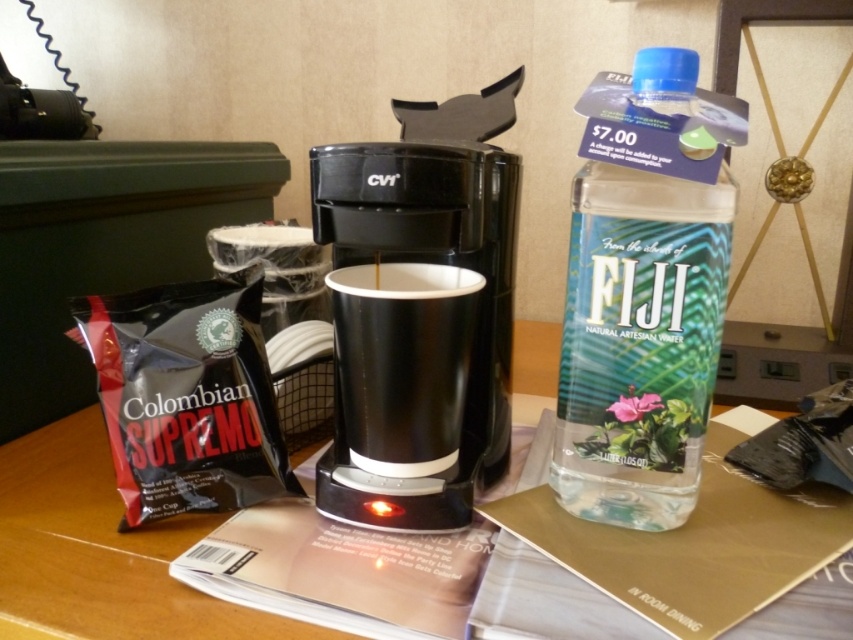
What object is located at the coordinates point (421, 310)?

The point (421, 310) indicates the black plastic coffee maker at center.

You are a hotel guest who wants to grab both items located at point coordinates point (x=476, y=227) and point (x=421, y=336). Since you can only reach one at a time, which item should you reach for first to ensure you can grab both without moving your hand?

You should reach for point (x=421, y=336) first because point (x=476, y=227) is behind it. By grabbing the closer item first, you can then move to the one behind without obstruction.

Based on the photo, you are a hotel guest who wants to place a small note on the table near the coffee maker. The note is 2 inches thick. Can you place it at point [585,321] without it falling off?

The distance between point [585,321] and the camera is 16.53 inches. Since the note is only 2 inches thick, it can be placed there safely without falling off.